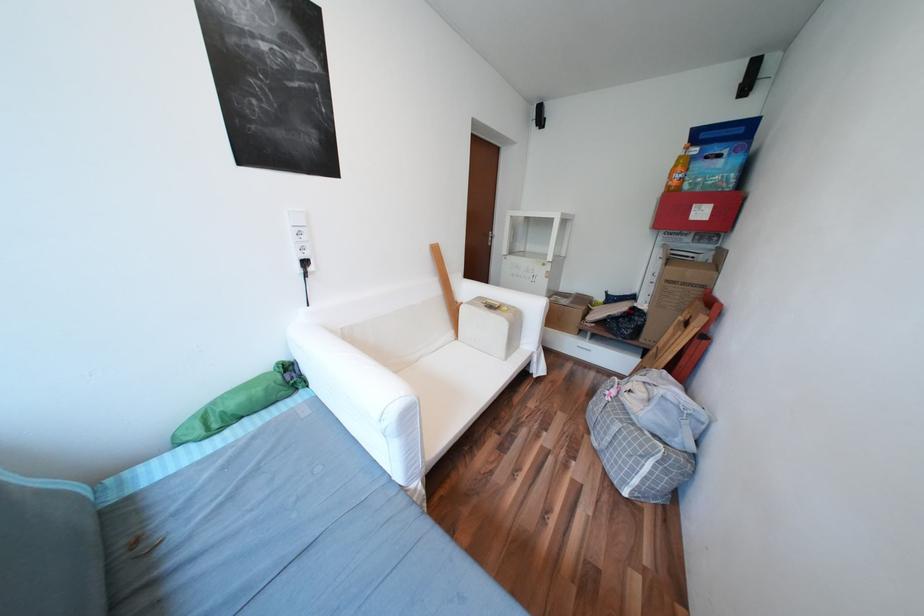
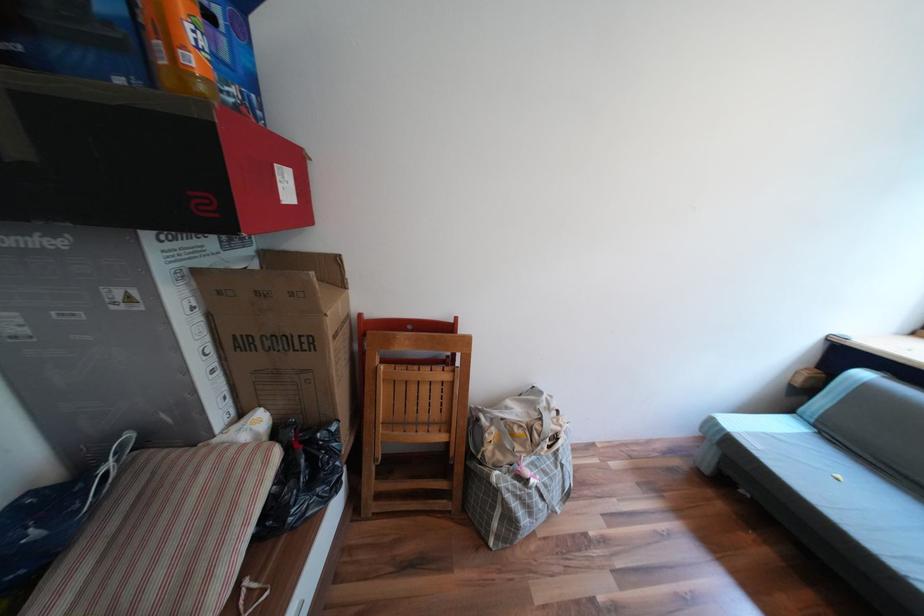
Locate, in the second image, the point that corresponds to pixel 665 275 in the first image.

(219, 349)